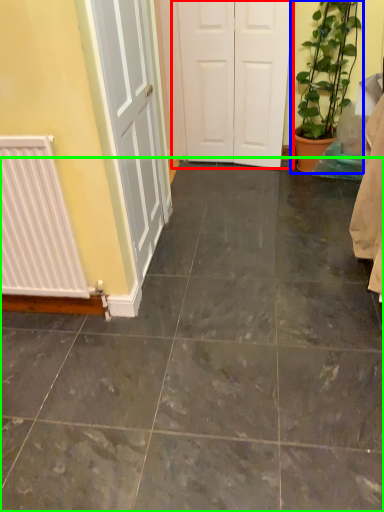
Question: Which object is positioned farthest from door (highlighted by a red box)? Select from houseplant (highlighted by a blue box) and ceramic tile (highlighted by a green box).

Choices:
 (A) houseplant
 (B) ceramic tile

Answer: (B)